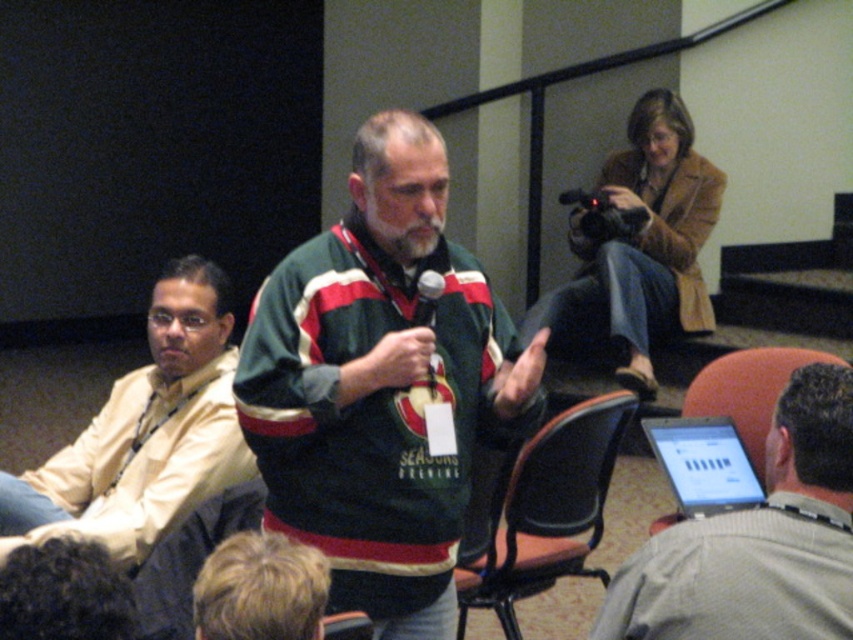
Looking at this image, which is above, green knit sweater at center or silver metallic laptop at lower right?

green knit sweater at center

Does green knit sweater at center lie in front of silver metallic laptop at lower right?

That is True.

Who is more forward, (479, 278) or (724, 429)?

Point (479, 278) is more forward.

Locate an element on the screen. The height and width of the screenshot is (640, 853). green knit sweater at center is located at coordinates (379, 394).

Who is lower down, gray fabric shirt at lower right or orange fabric chair at lower right?

gray fabric shirt at lower right is lower down.

Does gray fabric shirt at lower right have a larger size compared to orange fabric chair at lower right?

Indeed, gray fabric shirt at lower right has a larger size compared to orange fabric chair at lower right.

Between point (688, 593) and point (722, 378), which one is positioned behind?

Point (722, 378)

At what (x,y) coordinates should I click in order to perform the action: click on gray fabric shirt at lower right. Please return your answer as a coordinate pair (x, y). This screenshot has width=853, height=640. Looking at the image, I should click on (757, 540).

In the scene shown: Can you confirm if green knit sweater at center is positioned above gray fabric shirt at lower right?

Yes, green knit sweater at center is above gray fabric shirt at lower right.

Who is more distant from viewer, (259,333) or (850,385)?

The point (259,333) is more distant.

Locate an element on the screen. The height and width of the screenshot is (640, 853). green knit sweater at center is located at coordinates (379, 394).